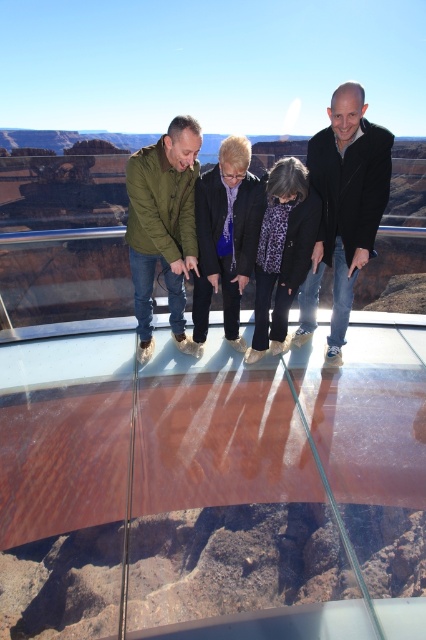
Question: Does green matte jacket at left appear under leopard print coat at center?

Choices:
 (A) no
 (B) yes

Answer: (A)

Question: Does transparent glass table at center appear over purple fabric at center?

Choices:
 (A) no
 (B) yes

Answer: (A)

Question: Which is nearer to the green matte jacket at left?

Choices:
 (A) transparent glass table at center
 (B) black matte jacket at center

Answer: (B)

Question: Does black matte jacket at center have a larger size compared to green matte jacket at left?

Choices:
 (A) no
 (B) yes

Answer: (A)

Question: Which object appears farthest from the camera in this image?

Choices:
 (A) black matte jacket at center
 (B) leopard print coat at center
 (C) purple fabric at center

Answer: (B)

Question: Estimate the real-world distances between objects in this image. Which object is farther from the leopard print coat at center?

Choices:
 (A) purple fabric at center
 (B) black matte jacket at center
 (C) transparent glass table at center

Answer: (C)